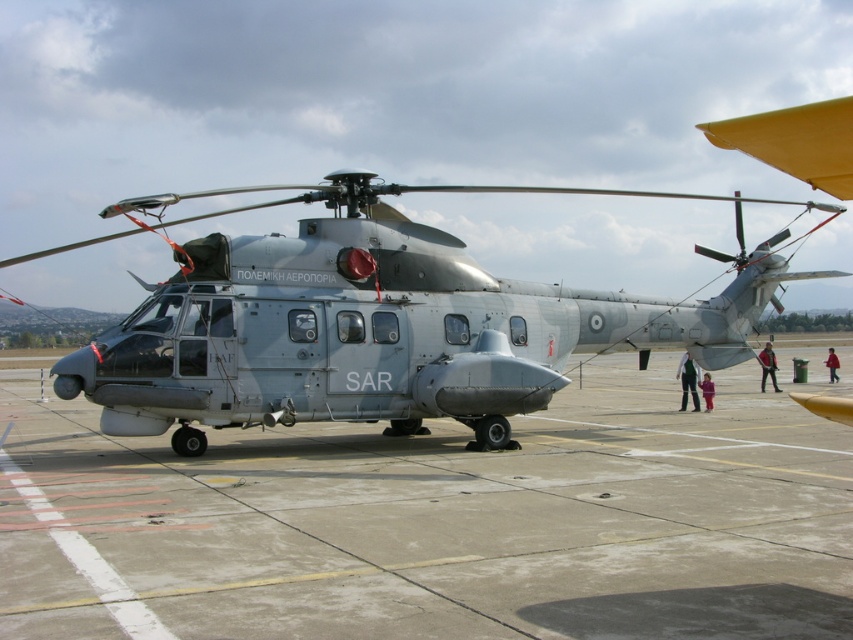
Question: Does gray concrete tarmac at center have a smaller size compared to black fabric jacket at lower right?

Choices:
 (A) no
 (B) yes

Answer: (A)

Question: Is dark blue jeans at center thinner than red cotton jacket at lower right?

Choices:
 (A) yes
 (B) no

Answer: (B)

Question: Which of the following is the farthest from the observer?

Choices:
 (A) (762, 365)
 (B) (350, 376)

Answer: (A)

Question: Among these objects, which one is nearest to the camera?

Choices:
 (A) gray concrete tarmac at center
 (B) purple fabric pants at lower center
 (C) black fabric jacket at lower right

Answer: (A)

Question: Observing the image, what is the correct spatial positioning of gray concrete tarmac at center in reference to dark blue jeans at center?

Choices:
 (A) above
 (B) below

Answer: (B)

Question: Which of these objects is positioned closest to the gray concrete tarmac at center?

Choices:
 (A) dark blue jeans at center
 (B) black fabric jacket at lower right

Answer: (A)